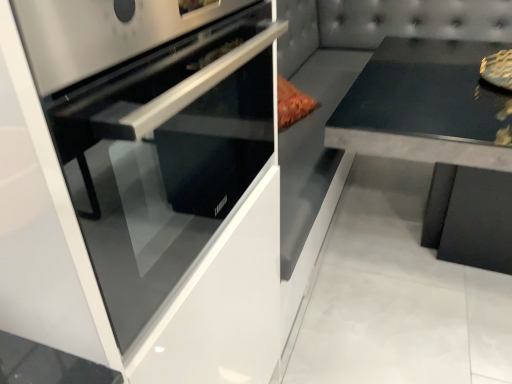
Identify the location of satin black oven at left. The height and width of the screenshot is (384, 512). (161, 173).

This screenshot has width=512, height=384. Describe the element at coordinates (161, 173) in the screenshot. I see `satin black oven at left` at that location.

Locate an element on the screen. The image size is (512, 384). black concrete table at right is located at coordinates (440, 140).

What do you see at coordinates (440, 140) in the screenshot? Image resolution: width=512 pixels, height=384 pixels. I see `black concrete table at right` at bounding box center [440, 140].

This screenshot has height=384, width=512. What are the coordinates of `satin black oven at left` in the screenshot? It's located at (161, 173).

Based on the photo, considering the positions of objects satin black oven at left and black concrete table at right in the image provided, who is more to the right, satin black oven at left or black concrete table at right?

black concrete table at right is more to the right.

Is satin black oven at left positioned before black concrete table at right?

Yes, satin black oven at left is in front of black concrete table at right.

Is point (216, 364) closer to camera compared to point (400, 142)?

Yes, point (216, 364) is closer to viewer.

From the image's perspective, is satin black oven at left under black concrete table at right?

Correct, satin black oven at left appears lower than black concrete table at right in the image.

From a real-world perspective, is satin black oven at left under black concrete table at right?

No.

Looking at their sizes, would you say satin black oven at left is wider or thinner than black concrete table at right?

Clearly, satin black oven at left has less width compared to black concrete table at right.

From their relative heights in the image, would you say satin black oven at left is taller or shorter than black concrete table at right?

In the image, satin black oven at left appears to be shorter than black concrete table at right.

Who is bigger, satin black oven at left or black concrete table at right?

black concrete table at right is bigger.

Can black concrete table at right be found inside satin black oven at left?

No, black concrete table at right is not inside satin black oven at left.

Is satin black oven at left far away from black concrete table at right?

They are positioned close to each other.

Is satin black oven at left turned away from black concrete table at right?

No.

At what (x,y) coordinates should I click in order to perform the action: click on home appliance that is on the left side of black concrete table at right. Please return your answer as a coordinate pair (x, y). Looking at the image, I should click on (161, 173).

Which is more to the left, black concrete table at right or satin black oven at left?

Positioned to the left is satin black oven at left.

Considering the positions of objects black concrete table at right and satin black oven at left in the image provided, who is in front, black concrete table at right or satin black oven at left?

Positioned in front is satin black oven at left.

Which point is more forward, (432, 53) or (164, 131)?

Point (164, 131)

From the image's perspective, is black concrete table at right over satin black oven at left?

Yes, from the image's perspective, black concrete table at right is on top of satin black oven at left.

From a real-world perspective, is black concrete table at right physically above satin black oven at left?

Actually, black concrete table at right is physically below satin black oven at left in the real world.

Can you confirm if black concrete table at right is thinner than satin black oven at left?

No, black concrete table at right is not thinner than satin black oven at left.

Which of these two, black concrete table at right or satin black oven at left, stands taller?

black concrete table at right is taller.

Between black concrete table at right and satin black oven at left, which one has larger size?

With larger size is black concrete table at right.

Is black concrete table at right not inside satin black oven at left?

Yes, black concrete table at right is located beyond the bounds of satin black oven at left.

From the picture: Are black concrete table at right and satin black oven at left located far from each other?

That's not correct — black concrete table at right is a little close to satin black oven at left.

From the picture: Is satin black oven at left at the back of black concrete table at right?

No, black concrete table at right is not facing away from satin black oven at left.

How far apart are black concrete table at right and satin black oven at left?

black concrete table at right is 39.09 inches away from satin black oven at left.

Find the location of a particular element. home appliance located on the left of black concrete table at right is located at coordinates (161, 173).

Image resolution: width=512 pixels, height=384 pixels. Find the location of `home appliance positioned vertically above the black concrete table at right (from a real-world perspective)`. home appliance positioned vertically above the black concrete table at right (from a real-world perspective) is located at coordinates (161, 173).

Identify the location of home appliance that appears in front of the black concrete table at right. This screenshot has width=512, height=384. (161, 173).